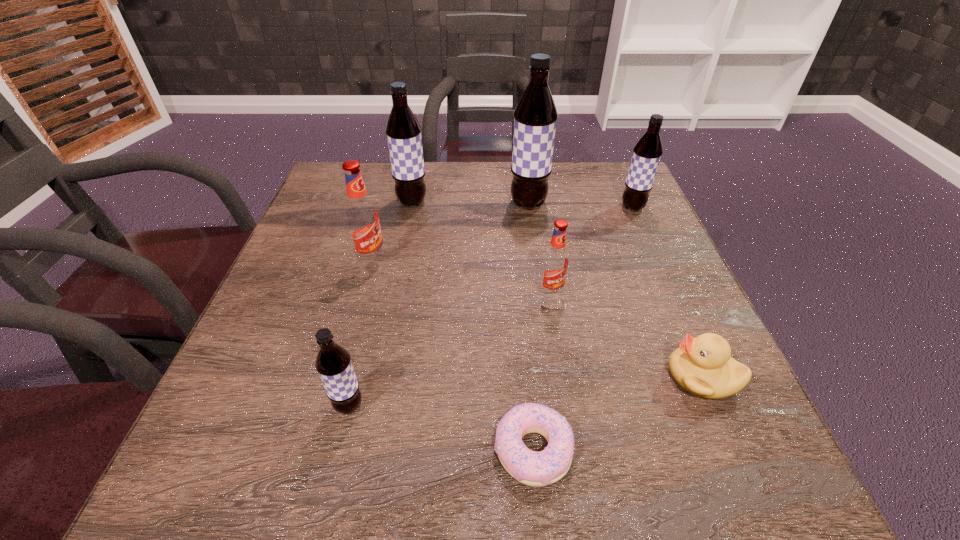
At what (x,y) coordinates should I click in order to perform the action: click on free space located on the front of the fourth nearest object. Please return your answer as a coordinate pair (x, y). The width and height of the screenshot is (960, 540). Looking at the image, I should click on (573, 427).

At what (x,y) coordinates should I click in order to perform the action: click on free space located 0.330m on the right of the nearest root beer. Please return your answer as a coordinate pair (x, y). The height and width of the screenshot is (540, 960). Looking at the image, I should click on point(567,406).

This screenshot has width=960, height=540. I want to click on free region located 0.150m on the beak of the duckling, so click(581, 376).

Identify the location of free point located 0.180m on the beak of the duckling. (564, 376).

I want to click on vacant area located on the beak of the duckling, so click(x=535, y=376).

You are a GUI agent. You are given a task and a screenshot of the screen. Output one action in this format:
    pyautogui.click(x=<x>, y=<y>)
    Task: Click on the vacant space located 0.090m on the right of the pink doughnut
    
    Given the screenshot: What is the action you would take?
    pyautogui.click(x=633, y=450)

The height and width of the screenshot is (540, 960). I want to click on object that is at the near edge, so click(546, 467).

Where is `object that is at the left edge`? The width and height of the screenshot is (960, 540). object that is at the left edge is located at coordinates (362, 219).

Image resolution: width=960 pixels, height=540 pixels. In order to click on root beer that is at the right edge in this screenshot , I will do `click(647, 152)`.

You are a GUI agent. You are given a task and a screenshot of the screen. Output one action in this format:
    pyautogui.click(x=<x>, y=<y>)
    Task: Click on the duckling located at the right edge
    The image size is (960, 540).
    Given the screenshot: What is the action you would take?
    pyautogui.click(x=703, y=365)